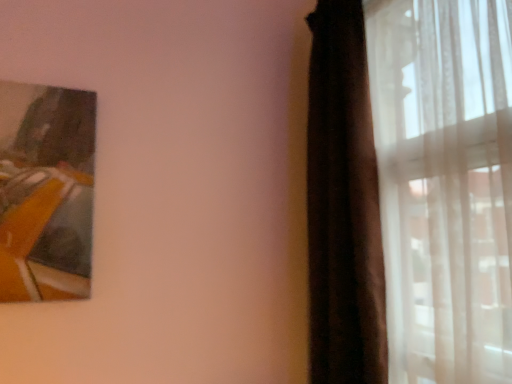
Question: From a real-world perspective, is brown velvet curtain at right, marked as the 2th curtain in a right-to-left arrangement, beneath silky white curtain at right, which is counted as the second curtain, starting from the left?

Choices:
 (A) yes
 (B) no

Answer: (B)

Question: From a real-world perspective, is brown velvet curtain at right, the first curtain viewed from the left, over silky white curtain at right, arranged as the first curtain when viewed from the right?

Choices:
 (A) no
 (B) yes

Answer: (B)

Question: Is brown velvet curtain at right, the first curtain viewed from the left, touching silky white curtain at right, arranged as the first curtain when viewed from the right?

Choices:
 (A) no
 (B) yes

Answer: (B)

Question: Can you confirm if brown velvet curtain at right, marked as the 2th curtain in a right-to-left arrangement, is positioned to the right of silky white curtain at right, which is counted as the second curtain, starting from the left?

Choices:
 (A) yes
 (B) no

Answer: (B)

Question: Does brown velvet curtain at right, marked as the 2th curtain in a right-to-left arrangement, lie in front of silky white curtain at right, which is counted as the second curtain, starting from the left?

Choices:
 (A) yes
 (B) no

Answer: (B)

Question: Are brown velvet curtain at right, marked as the 2th curtain in a right-to-left arrangement, and silky white curtain at right, which is counted as the second curtain, starting from the left, located far from each other?

Choices:
 (A) yes
 (B) no

Answer: (B)

Question: Is silky white curtain at right, which is counted as the second curtain, starting from the left, taller than brown velvet curtain at right, the first curtain viewed from the left?

Choices:
 (A) no
 (B) yes

Answer: (A)

Question: Is brown velvet curtain at right, the first curtain viewed from the left, completely or partially inside silky white curtain at right, arranged as the first curtain when viewed from the right?

Choices:
 (A) yes
 (B) no

Answer: (A)

Question: Is silky white curtain at right, which is counted as the second curtain, starting from the left, smaller than brown velvet curtain at right, the first curtain viewed from the left?

Choices:
 (A) yes
 (B) no

Answer: (B)

Question: Is the depth of silky white curtain at right, which is counted as the second curtain, starting from the left, less than that of brown velvet curtain at right, marked as the 2th curtain in a right-to-left arrangement?

Choices:
 (A) no
 (B) yes

Answer: (B)

Question: Is silky white curtain at right, which is counted as the second curtain, starting from the left, further to the viewer compared to brown velvet curtain at right, the first curtain viewed from the left?

Choices:
 (A) no
 (B) yes

Answer: (A)

Question: From a real-world perspective, is silky white curtain at right, which is counted as the second curtain, starting from the left, over brown velvet curtain at right, marked as the 2th curtain in a right-to-left arrangement?

Choices:
 (A) yes
 (B) no

Answer: (B)

Question: Is point (460, 259) closer or farther from the camera than point (358, 370)?

Choices:
 (A) closer
 (B) farther

Answer: (A)